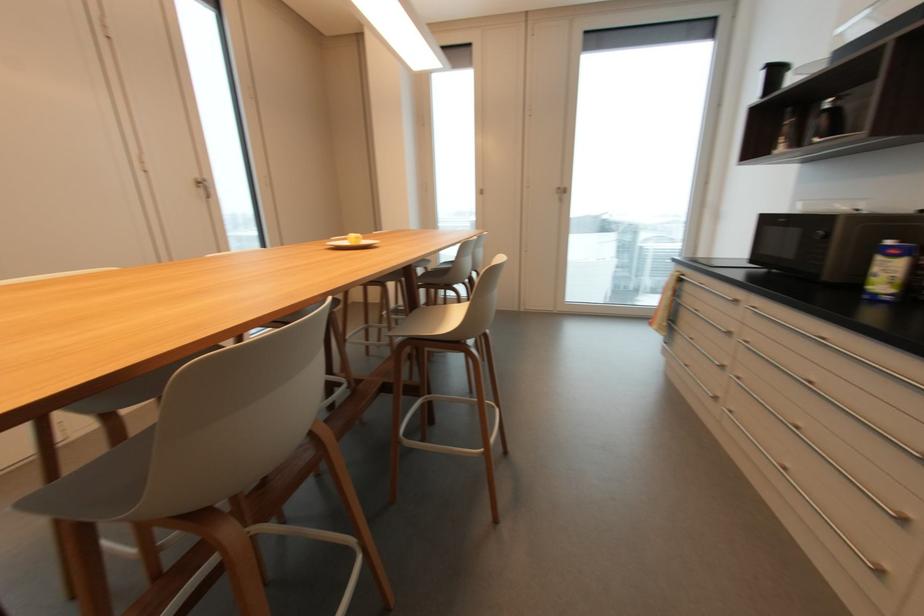
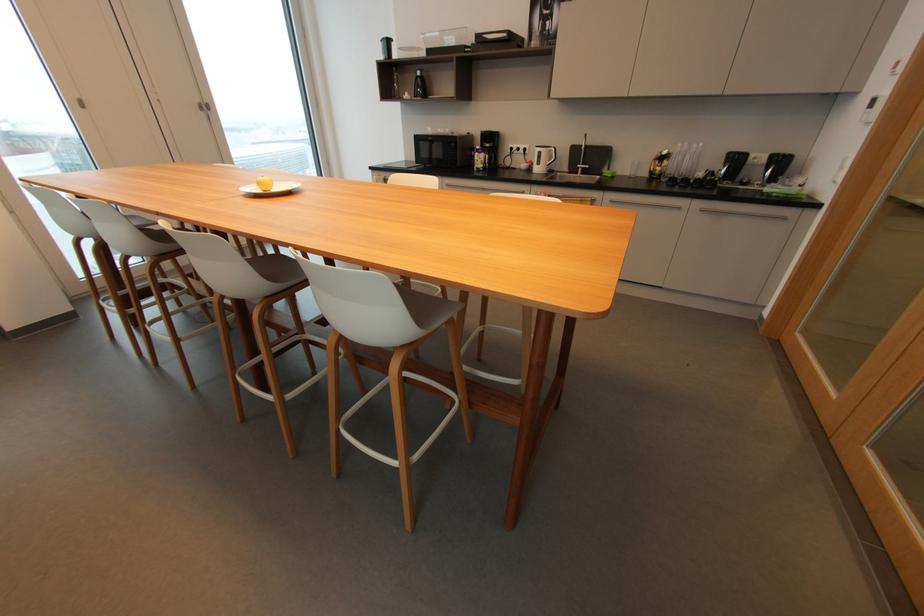
The point at (x=484, y=193) is marked in the first image. Where is the corresponding point in the second image?

(81, 103)